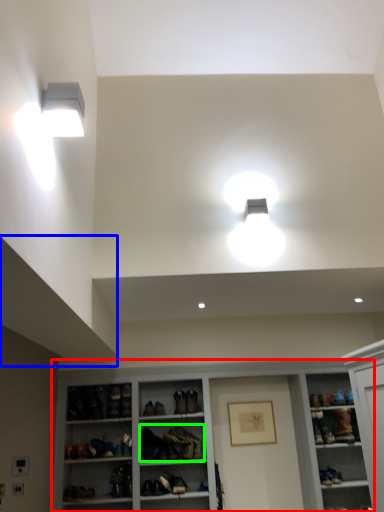
Question: Which object is the farthest from shelf (highlighted by a red box)? Choose among these: exhaust hood (highlighted by a blue box) or clothing (highlighted by a green box).

Choices:
 (A) exhaust hood
 (B) clothing

Answer: (A)